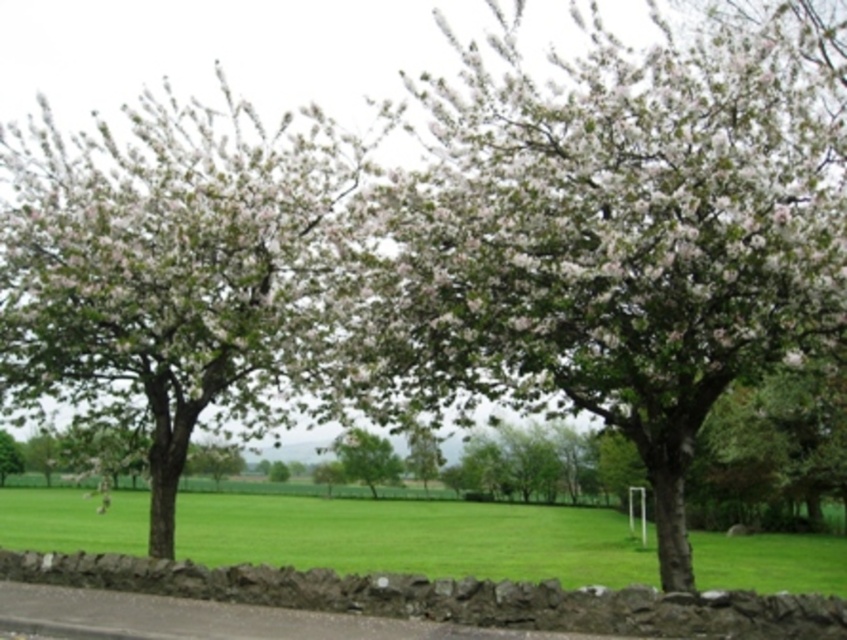
Question: Which object is farther from the camera taking this photo?

Choices:
 (A) green leafy tree at center
 (B) green grass at center

Answer: (B)

Question: Is green leafy tree at center smaller than white blossoming tree at center?

Choices:
 (A) yes
 (B) no

Answer: (B)

Question: Does green grass at center come in front of green leafy tree at center?

Choices:
 (A) yes
 (B) no

Answer: (B)

Question: Which of the following is the closest to the observer?

Choices:
 (A) (x=401, y=468)
 (B) (x=19, y=465)

Answer: (A)

Question: Which point is closer to the camera?

Choices:
 (A) green leafy tree at center
 (B) white blossoming tree at center

Answer: (A)

Question: Can you confirm if green grass at center is wider than white blossoming tree at center?

Choices:
 (A) yes
 (B) no

Answer: (A)